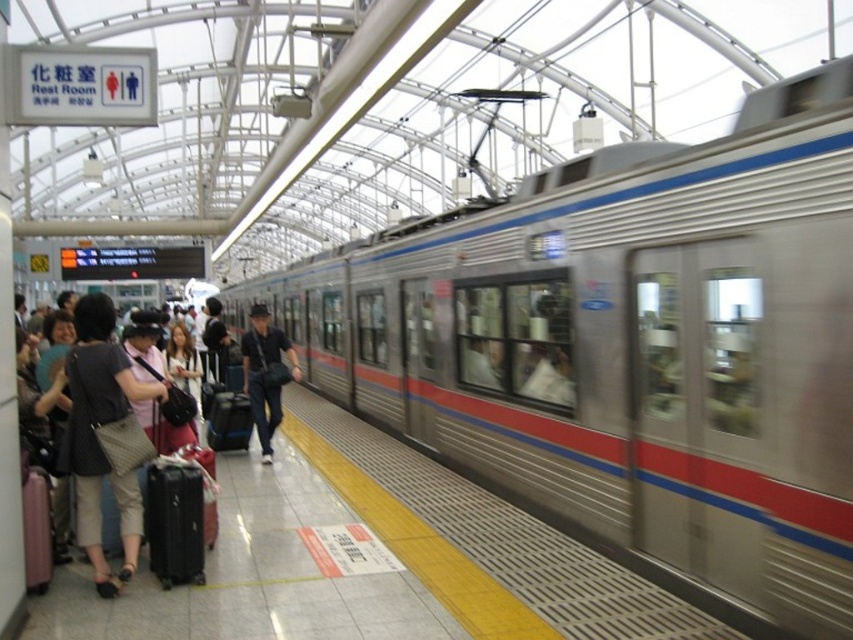
Which is in front, point (370, 323) or point (44, 497)?

Positioned in front is point (44, 497).

Image resolution: width=853 pixels, height=640 pixels. What do you see at coordinates (630, 346) in the screenshot? I see `silver metallic train at center` at bounding box center [630, 346].

At what (x,y) coordinates should I click in order to perform the action: click on silver metallic train at center. Please return your answer as a coordinate pair (x, y). This screenshot has width=853, height=640. Looking at the image, I should click on (630, 346).

Is black hard suitcase at center above matte black bag at center?

Incorrect, black hard suitcase at center is not positioned above matte black bag at center.

You are a GUI agent. You are given a task and a screenshot of the screen. Output one action in this format:
    pyautogui.click(x=<x>, y=<y>)
    Task: Click on the black hard suitcase at center
    This screenshot has height=640, width=853.
    Given the screenshot: What is the action you would take?
    pyautogui.click(x=173, y=508)

At what (x,y) coordinates should I click in order to perform the action: click on matte black bag at center. Please return your answer as a coordinate pair (x, y). The height and width of the screenshot is (640, 853). Looking at the image, I should click on [x=265, y=372].

Looking at this image, between matte black bag at center and matte pink suitcase at lower left, which one is positioned lower?

matte pink suitcase at lower left

Where is `matte black bag at center`? matte black bag at center is located at coordinates (265, 372).